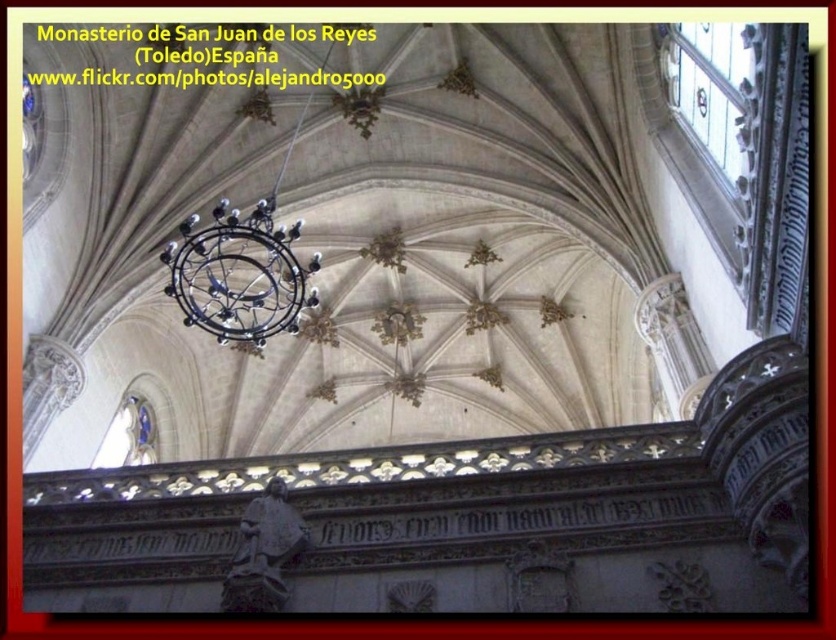
Question: Is black wrought iron chandelier at center closer to the viewer compared to dark gray stone statue at lower center?

Choices:
 (A) yes
 (B) no

Answer: (B)

Question: Does black wrought iron chandelier at center appear under dark gray stone statue at lower center?

Choices:
 (A) no
 (B) yes

Answer: (A)

Question: Which object is farther from the camera taking this photo?

Choices:
 (A) black wrought iron chandelier at center
 (B) dark gray stone statue at lower center

Answer: (A)

Question: Is black wrought iron chandelier at center to the left of dark gray stone statue at lower center from the viewer's perspective?

Choices:
 (A) yes
 (B) no

Answer: (A)

Question: Among these points, which one is nearest to the camera?

Choices:
 (A) (241, 262)
 (B) (227, 577)

Answer: (B)